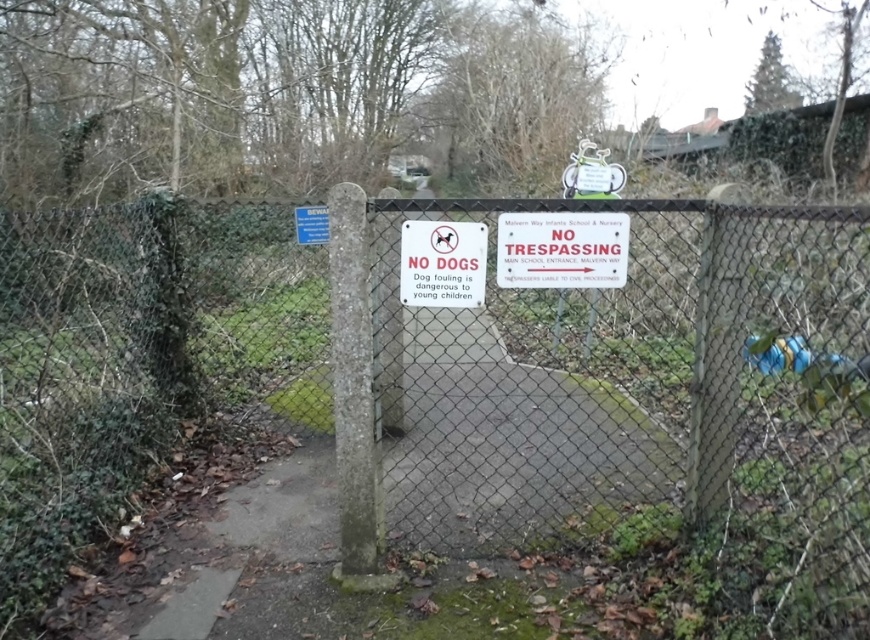
Can you confirm if wire mesh fence at center is wider than white plastic sign at center?

Yes.

Between wire mesh fence at center and white plastic sign at center, which one is positioned lower?

wire mesh fence at center is lower down.

Between point (399, 349) and point (418, 253), which one is positioned in front?

Point (418, 253) is in front.

You are a GUI agent. You are given a task and a screenshot of the screen. Output one action in this format:
    pyautogui.click(x=<x>, y=<y>)
    Task: Click on the wire mesh fence at center
    This screenshot has height=640, width=870.
    Given the screenshot: What is the action you would take?
    pyautogui.click(x=454, y=384)

What do you see at coordinates (561, 250) in the screenshot?
I see `red plastic sign at center` at bounding box center [561, 250].

I want to click on red plastic sign at center, so click(561, 250).

Identify the location of red plastic sign at center. (561, 250).

Is point (263, 524) more distant than point (413, 250)?

Yes.

Is point (413, 333) closer to camera compared to point (407, 237)?

No, it is not.

Image resolution: width=870 pixels, height=640 pixels. In order to click on concrete at center in this screenshot , I will do `click(510, 445)`.

You are a GUI agent. You are given a task and a screenshot of the screen. Output one action in this format:
    pyautogui.click(x=<x>, y=<y>)
    Task: Click on the concrete at center
    Image resolution: width=870 pixels, height=640 pixels.
    Given the screenshot: What is the action you would take?
    pyautogui.click(x=510, y=445)